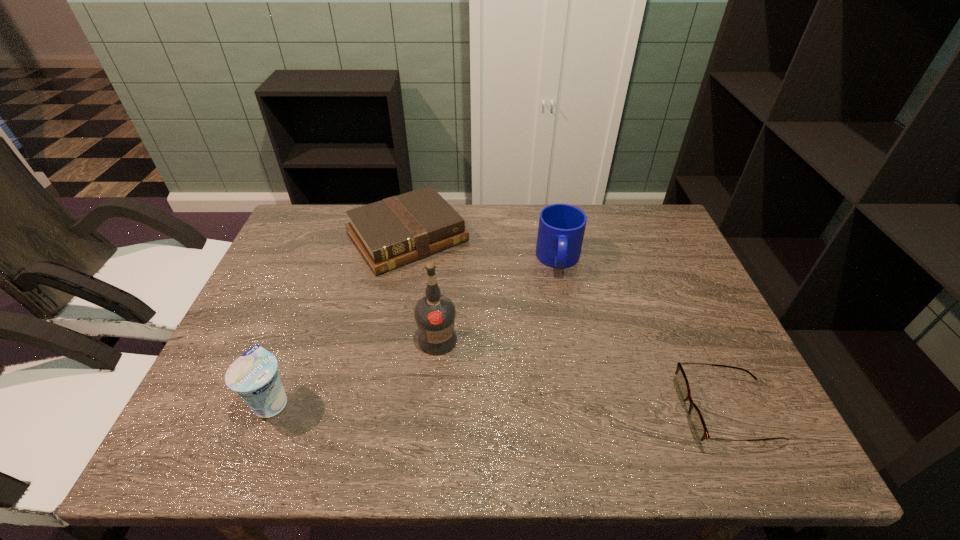
Identify the location of vacant space located on the face of the rightmost object. (549, 412).

Locate an element on the screen. vacant space located 0.210m on the spine side of the second shortest object is located at coordinates (476, 318).

Where is `free space located on the spine side of the second shortest object`? The height and width of the screenshot is (540, 960). free space located on the spine side of the second shortest object is located at coordinates (451, 288).

Locate an element on the screen. The image size is (960, 540). blank area located on the spine side of the second shortest object is located at coordinates (490, 334).

The image size is (960, 540). I want to click on vacant region located 0.050m on the side with the handle of the fourth object from left to right, so (x=561, y=294).

You are a GUI agent. You are given a task and a screenshot of the screen. Output one action in this format:
    pyautogui.click(x=<x>, y=<y>)
    Task: Click on the blank area located on the side with the handle of the fourth object from left to right
    
    Given the screenshot: What is the action you would take?
    pyautogui.click(x=561, y=305)

Locate an element on the screen. The height and width of the screenshot is (540, 960). vacant position located 0.130m on the side with the handle of the fourth object from left to right is located at coordinates (561, 316).

In order to click on vacant space situated 0.210m on the front label of the vodka in this screenshot , I will do `click(516, 410)`.

You are a GUI agent. You are given a task and a screenshot of the screen. Output one action in this format:
    pyautogui.click(x=<x>, y=<y>)
    Task: Click on the free space located 0.180m on the front label of the vodka
    
    Given the screenshot: What is the action you would take?
    pyautogui.click(x=506, y=401)

Image resolution: width=960 pixels, height=540 pixels. What are the coordinates of `vacant space positioned on the front label of the vodka` in the screenshot? It's located at (483, 381).